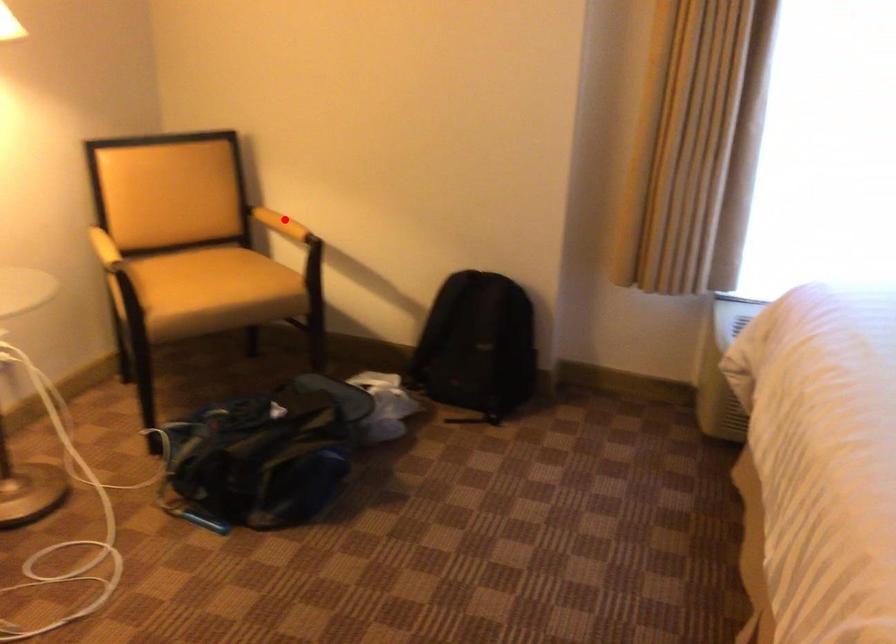
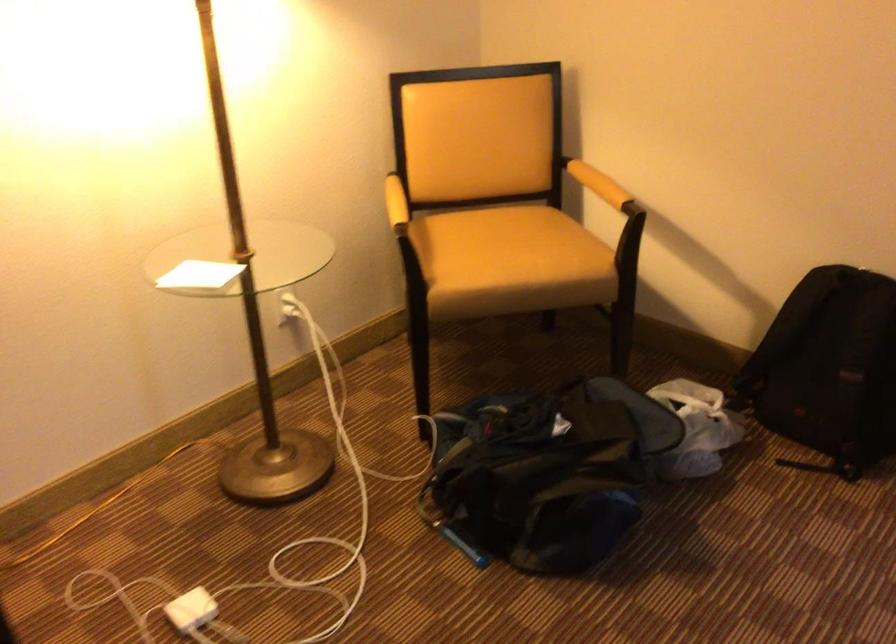
Locate, in the second image, the point that corresponds to the highlighted location in the first image.

(598, 184)